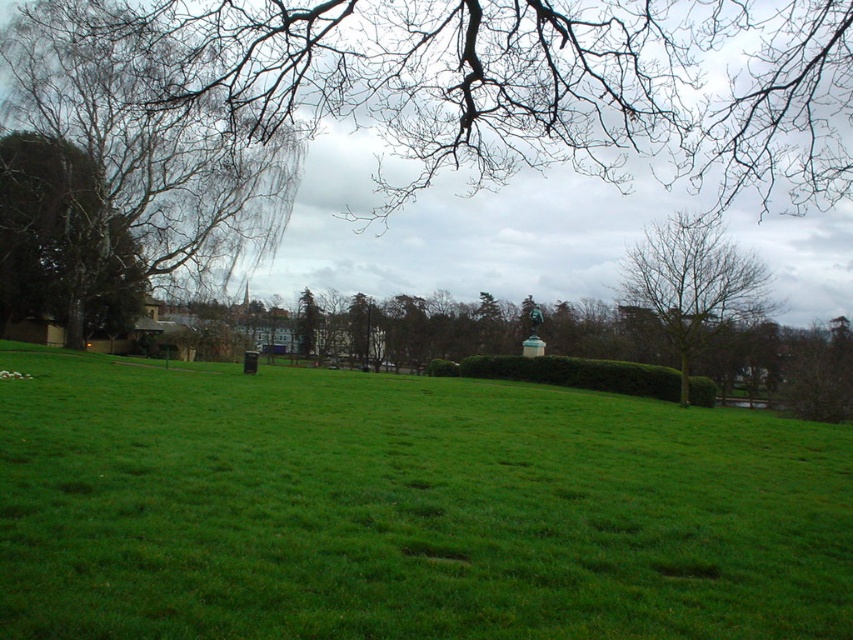
You are standing at the center of the park and want to find the green leafy tree at left. Which direction should you face to see it?

The green leafy tree at left is located at point [62,241], which means it is positioned to the left and slightly forward from the center. To face it, you should turn towards the left direction.

You are planning to plant a new tree in the park. The green leafy tree at left and the bare branches at upper right are already present. Which of these two has a wider spread in terms of its canopy or branches?

The green leafy tree at left has a wider spread in terms of its canopy or branches compared to the bare branches at upper right.

You are standing in the park and see both the bare branches at left and the green leafy tree at left. Which one appears closer to you?

The bare branches at left is in front of the green leafy tree at left, so it appears closer.